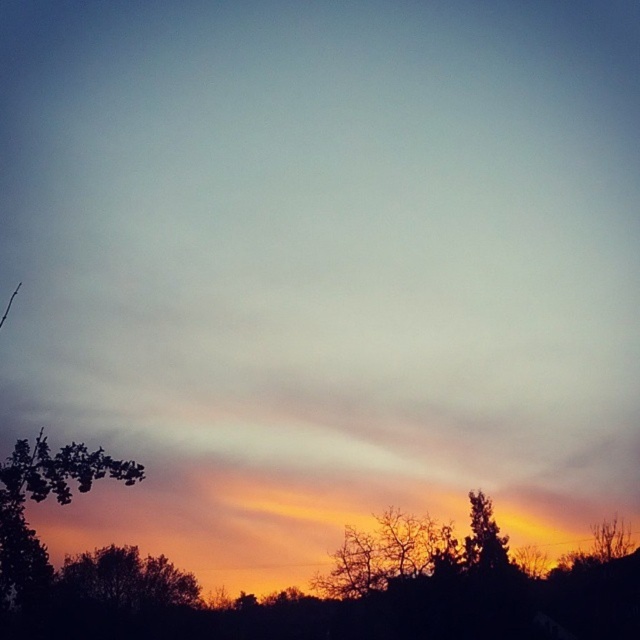
You are an artist sketching the sunset scene. You need to draw the silhouette bare tree at lower center and the silhouette tree at lower right. Based on their positions, which one should you draw first to ensure proper layering?

You should draw the silhouette tree at lower right first because the silhouette bare tree at lower center is positioned over it, meaning it should be drawn on top to maintain the correct layering.

You are standing in the sunset scene and want to place a small decorative light between the two points, point [349,564] and point [493,531]. Which point should the light be closer to if it needs to be in front of both points?

The light should be closer to point [349,564] because it is in front of point [493,531]. Placing it closer to the front point ensures it remains in front of both.